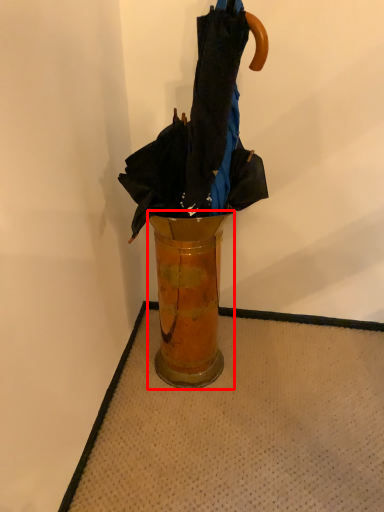
Question: Considering the relative positions of vase (annotated by the red box) and umbrella in the image provided, where is vase (annotated by the red box) located with respect to the staircase?

Choices:
 (A) left
 (B) right

Answer: (A)